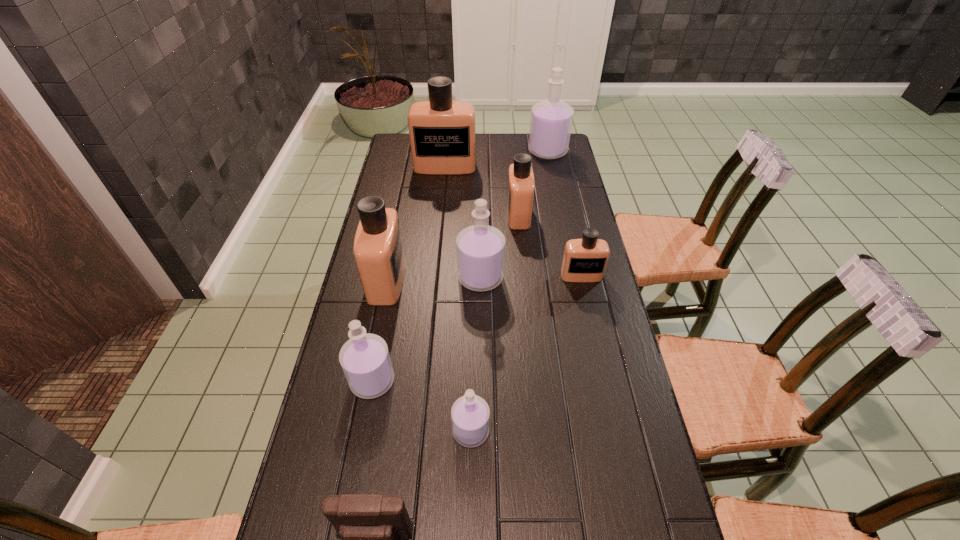
Locate an element on the screen. This screenshot has height=540, width=960. free space located 0.160m on the left of the second nearest object is located at coordinates (386, 431).

Locate an element on the screen. The height and width of the screenshot is (540, 960). vacant space located 0.380m on the front label of the rightmost beige perfume is located at coordinates (607, 390).

Where is `object that is at the far left corner`? The image size is (960, 540). object that is at the far left corner is located at coordinates (442, 132).

Where is `object located at the far right corner`? The width and height of the screenshot is (960, 540). object located at the far right corner is located at coordinates (551, 121).

Image resolution: width=960 pixels, height=540 pixels. I want to click on free region at the left edge of the desktop, so click(x=329, y=392).

Image resolution: width=960 pixels, height=540 pixels. Identify the location of vacant region at the right edge of the desktop. (583, 357).

Where is `vacant area that lies between the rightmost purple perfume and the second biggest beige perfume`? The image size is (960, 540). vacant area that lies between the rightmost purple perfume and the second biggest beige perfume is located at coordinates (468, 216).

Locate an element on the screen. The height and width of the screenshot is (540, 960). vacant area between the third object from right to left and the smallest beige perfume is located at coordinates (550, 245).

Identify the location of free area in between the third nearest object and the second biggest purple perfume. (426, 329).

What are the coordinates of `blank region between the second nearest perfume and the farthest beige perfume` in the screenshot? It's located at (409, 274).